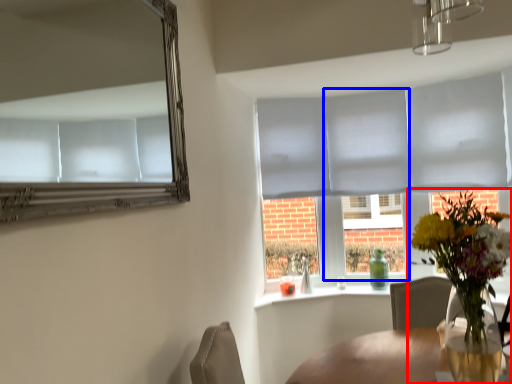
Question: Which object is further to the camera taking this photo, houseplant (highlighted by a red box) or glass door (highlighted by a blue box)?

Choices:
 (A) houseplant
 (B) glass door

Answer: (B)